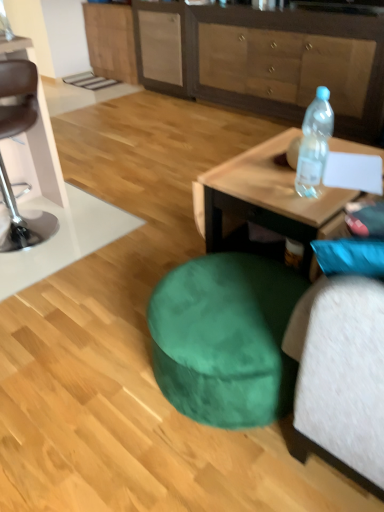
Question: From a real-world perspective, is brown leather bar stool at left positioned under wooden coffee table at right based on gravity?

Choices:
 (A) yes
 (B) no

Answer: (B)

Question: Considering the relative sizes of brown leather bar stool at left and wooden coffee table at right in the image provided, is brown leather bar stool at left bigger than wooden coffee table at right?

Choices:
 (A) yes
 (B) no

Answer: (A)

Question: Is brown leather bar stool at left located outside wooden coffee table at right?

Choices:
 (A) yes
 (B) no

Answer: (A)

Question: Does brown leather bar stool at left have a greater width compared to wooden coffee table at right?

Choices:
 (A) no
 (B) yes

Answer: (B)

Question: Considering the relative positions of brown leather bar stool at left and wooden coffee table at right in the image provided, is brown leather bar stool at left in front of wooden coffee table at right?

Choices:
 (A) no
 (B) yes

Answer: (A)

Question: Would you say brown leather bar stool at left is a long distance from wooden coffee table at right?

Choices:
 (A) yes
 (B) no

Answer: (A)

Question: Considering the relative positions of transparent plastic bottle at upper right and wooden coffee table at right in the image provided, is transparent plastic bottle at upper right to the right of wooden coffee table at right from the viewer's perspective?

Choices:
 (A) yes
 (B) no

Answer: (B)

Question: Is transparent plastic bottle at upper right surrounding wooden coffee table at right?

Choices:
 (A) no
 (B) yes

Answer: (A)

Question: From a real-world perspective, is transparent plastic bottle at upper right positioned over wooden coffee table at right based on gravity?

Choices:
 (A) no
 (B) yes

Answer: (B)

Question: From the image's perspective, is transparent plastic bottle at upper right on top of wooden coffee table at right?

Choices:
 (A) no
 (B) yes

Answer: (B)

Question: Is transparent plastic bottle at upper right wider than wooden coffee table at right?

Choices:
 (A) yes
 (B) no

Answer: (B)

Question: From the image's perspective, is transparent plastic bottle at upper right beneath wooden coffee table at right?

Choices:
 (A) no
 (B) yes

Answer: (A)

Question: Considering the relative positions of wooden coffee table at right and wooden cabinet at upper center, which is the 1th cabinetry in right-to-left order, in the image provided, is wooden coffee table at right in front of wooden cabinet at upper center, which is the 1th cabinetry in right-to-left order,?

Choices:
 (A) no
 (B) yes

Answer: (B)